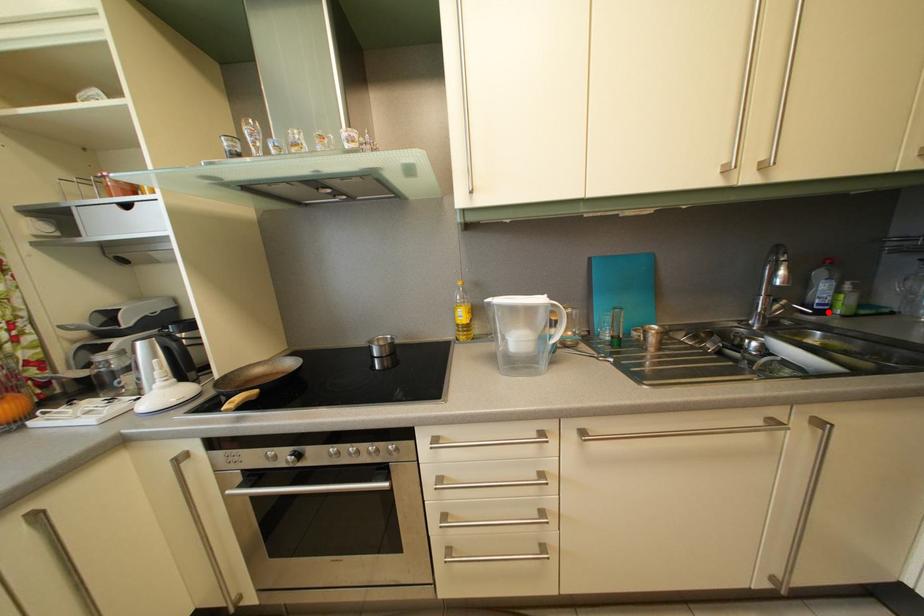
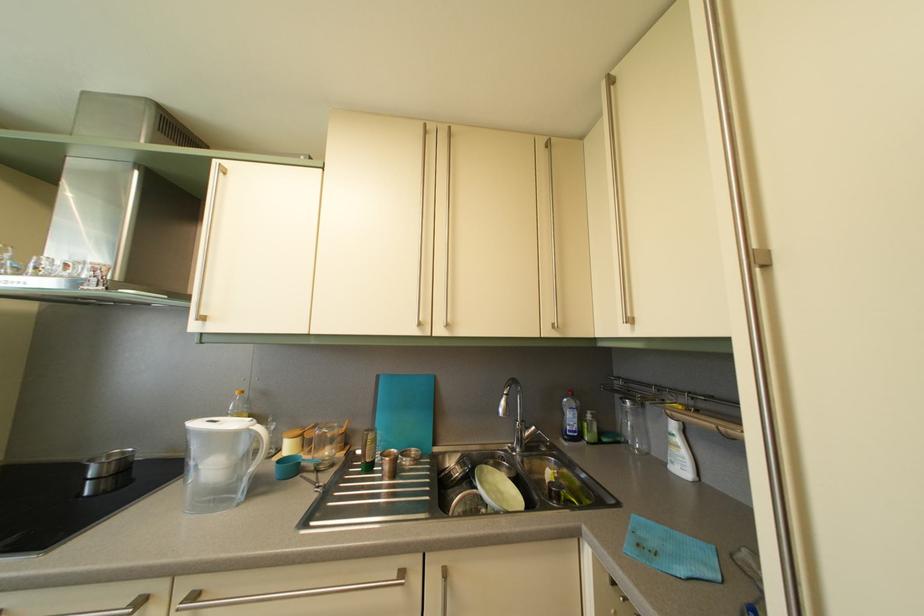
Locate, in the second image, the point that corresponds to the highlighted location in the first image.

(578, 439)